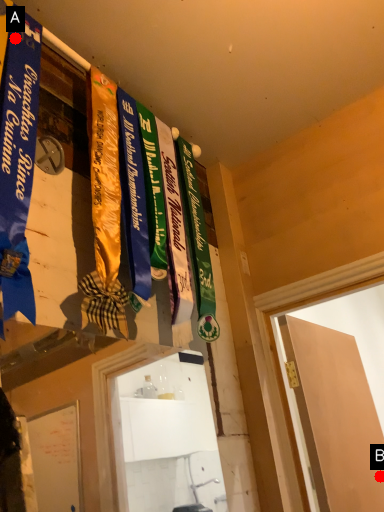
Question: Two points are circled on the image, labeled by A and B beside each circle. Among these points, which one is farthest from the camera?

Choices:
 (A) A is further
 (B) B is further

Answer: (B)